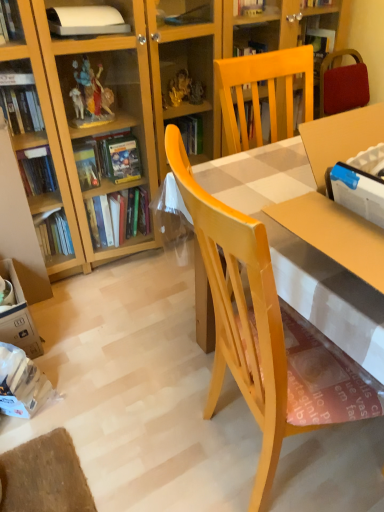
Measure the distance between point (x=253, y=263) and camera.

Point (x=253, y=263) is 24.84 inches away from camera.

This screenshot has width=384, height=512. I want to click on yellow wood chair at center, so click(241, 315).

What do you see at coordinates (241, 315) in the screenshot? This screenshot has height=512, width=384. I see `yellow wood chair at center` at bounding box center [241, 315].

Find the location of a particular element. The height and width of the screenshot is (512, 384). yellow wood chair at center is located at coordinates (241, 315).